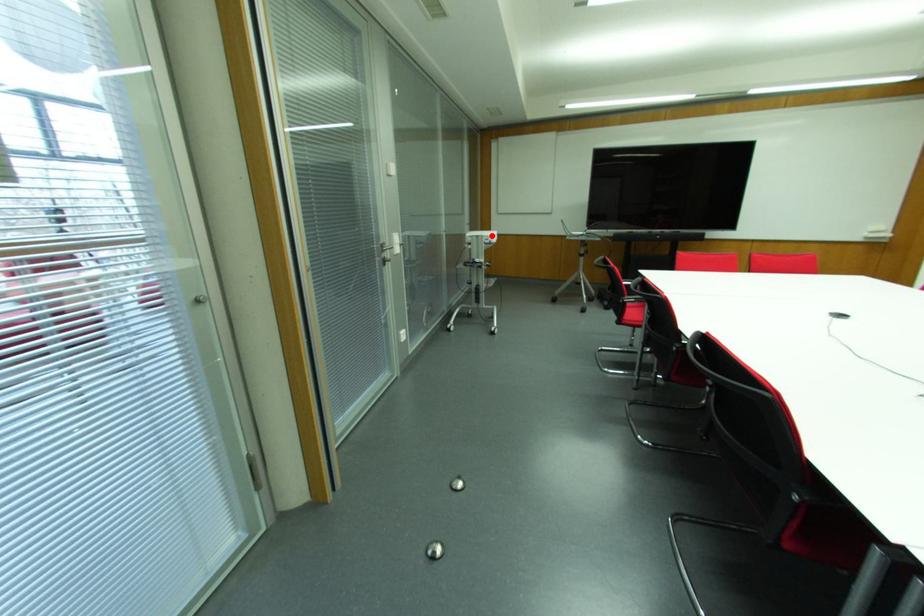
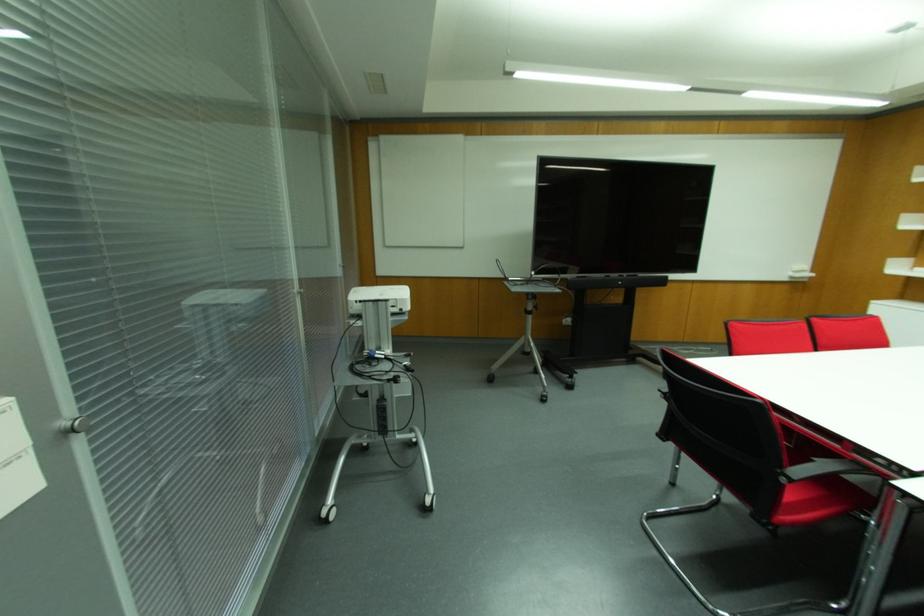
Where in the second image is the point corresponding to the highlighted location from the first image?

(399, 294)